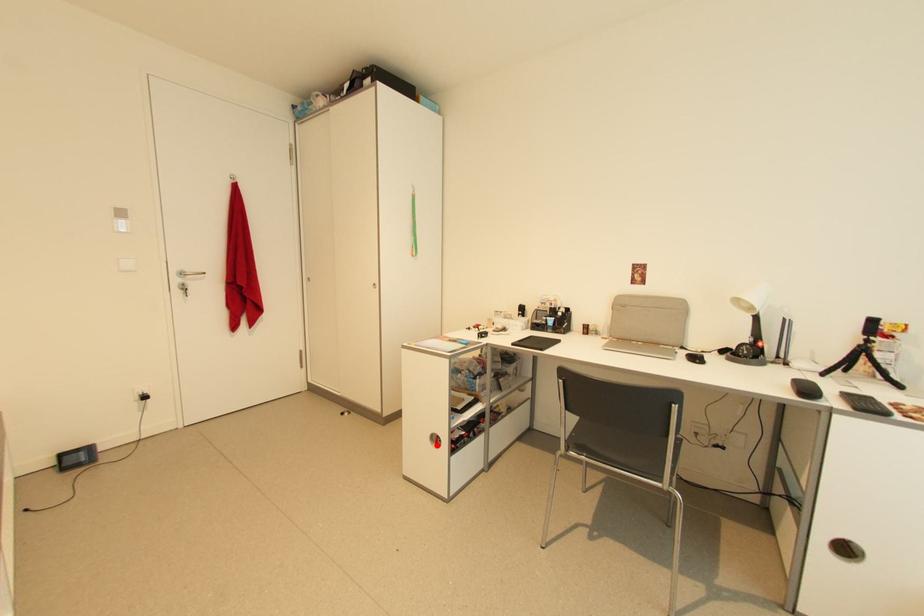
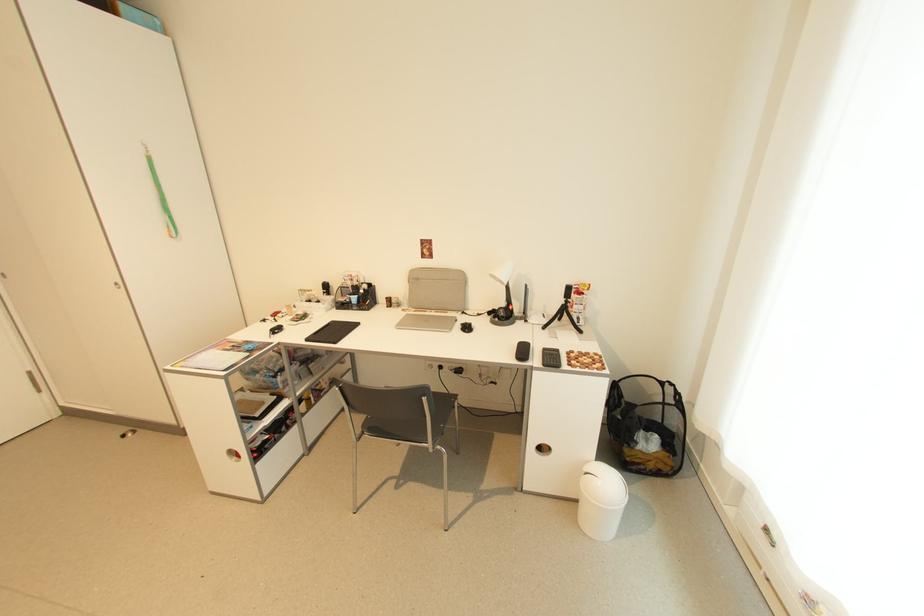
In the second image, find the point that corresponds to the highlighted location in the first image.

(237, 460)